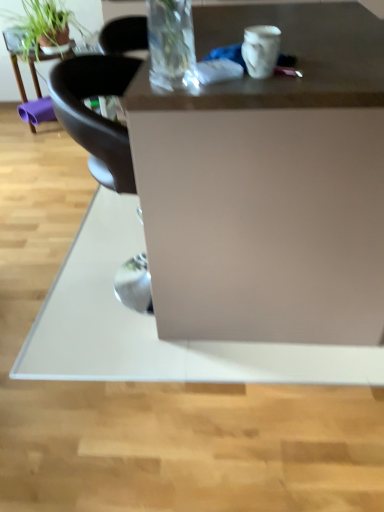
Find the location of a particular element. This screenshot has height=512, width=384. matte white desk at center is located at coordinates (268, 184).

This screenshot has width=384, height=512. Describe the element at coordinates (85, 12) in the screenshot. I see `green matte plant at upper left` at that location.

Locate an element on the screen. This screenshot has width=384, height=512. matte white desk at center is located at coordinates (268, 184).

Considering the sizes of matte black table at upper left and matte white desk at center in the image, is matte black table at upper left taller or shorter than matte white desk at center?

In the image, matte black table at upper left appears to be shorter than matte white desk at center.

Is matte black table at upper left further to the viewer compared to matte white desk at center?

Yes, it is.

Measure the distance from matte black table at upper left to matte white desk at center.

A distance of 7.23 feet exists between matte black table at upper left and matte white desk at center.

Is matte black table at upper left thinner than matte white desk at center?

Indeed, matte black table at upper left has a lesser width compared to matte white desk at center.

Is matte black table at upper left positioned with its back to green matte plant at upper left?

No, matte black table at upper left is not facing the opposite direction of green matte plant at upper left.

Looking at this image, from the image's perspective, is matte black table at upper left positioned above or below green matte plant at upper left?

Clearly, from the image's perspective, matte black table at upper left is below green matte plant at upper left.

From a real-world perspective, is matte black table at upper left beneath green matte plant at upper left?

Correct, in the physical world, matte black table at upper left is lower than green matte plant at upper left.

Considering the points (52, 116) and (56, 1), which point is in front, point (52, 116) or point (56, 1)?

Positioned in front is point (56, 1).

Considering their positions, is matte white desk at center located in front of or behind matte black table at upper left?

matte white desk at center is positioned closer to the viewer than matte black table at upper left.

Is matte white desk at center completely or partially outside of matte black table at upper left?

Absolutely, matte white desk at center is external to matte black table at upper left.

Considering the sizes of objects matte white desk at center and matte black table at upper left in the image provided, who is shorter, matte white desk at center or matte black table at upper left?

matte black table at upper left is shorter.

Consider the image. Which object is positioned more to the right, matte white desk at center or matte black table at upper left?

matte white desk at center.

Can you confirm if green matte plant at upper left is smaller than matte black table at upper left?

Incorrect, green matte plant at upper left is not smaller in size than matte black table at upper left.

Is green matte plant at upper left wider or thinner than matte black table at upper left?

green matte plant at upper left is wider than matte black table at upper left.

From the image's perspective, is green matte plant at upper left located above or below matte black table at upper left?

Based on their image positions, green matte plant at upper left is located above matte black table at upper left.

Which of these two, matte white desk at center or green matte plant at upper left, stands shorter?

green matte plant at upper left is shorter.

Is matte white desk at center not near green matte plant at upper left?

Yes, matte white desk at center is far from green matte plant at upper left.

Can you confirm if matte white desk at center is positioned to the left of green matte plant at upper left?

In fact, matte white desk at center is to the right of green matte plant at upper left.

How many degrees apart are the facing directions of matte white desk at center and green matte plant at upper left?

They differ by 90.2 degrees in their facing directions.

Can you confirm if green matte plant at upper left is bigger than matte white desk at center?

Actually, green matte plant at upper left might be smaller than matte white desk at center.

Is green matte plant at upper left further to the viewer compared to matte white desk at center?

Yes, green matte plant at upper left is behind matte white desk at center.

From the image's perspective, is green matte plant at upper left over matte white desk at center?

Correct, green matte plant at upper left appears higher than matte white desk at center in the image.

The image size is (384, 512). Identify the location of table lying behind the matte white desk at center. (33, 82).

At what (x,y) coordinates should I click in order to perform the action: click on houseplant that is in front of the matte black table at upper left. Please return your answer as a coordinate pair (x, y). This screenshot has width=384, height=512. Looking at the image, I should click on (85, 12).

Consider the image. Estimate the real-world distances between objects in this image. Which object is further from green matte plant at upper left, matte white desk at center or matte black table at upper left?

matte white desk at center.

From the picture: When comparing their distances from green matte plant at upper left, does matte black table at upper left or matte white desk at center seem further?

matte white desk at center.

When comparing their distances from matte white desk at center, does green matte plant at upper left or matte black table at upper left seem further?

matte black table at upper left.

Which object lies nearer to the anchor point matte white desk at center, matte black table at upper left or green matte plant at upper left?

The object closer to matte white desk at center is green matte plant at upper left.

Looking at the image, which one is located further to matte black table at upper left, matte white desk at center or green matte plant at upper left?

matte white desk at center is positioned further to the anchor matte black table at upper left.

Looking at this image, which object lies nearer to the anchor point matte black table at upper left, green matte plant at upper left or matte white desk at center?

Based on the image, green matte plant at upper left appears to be nearer to matte black table at upper left.

Where is `houseplant positioned between matte white desk at center and matte black table at upper left from near to far`? The width and height of the screenshot is (384, 512). houseplant positioned between matte white desk at center and matte black table at upper left from near to far is located at coordinates (85, 12).